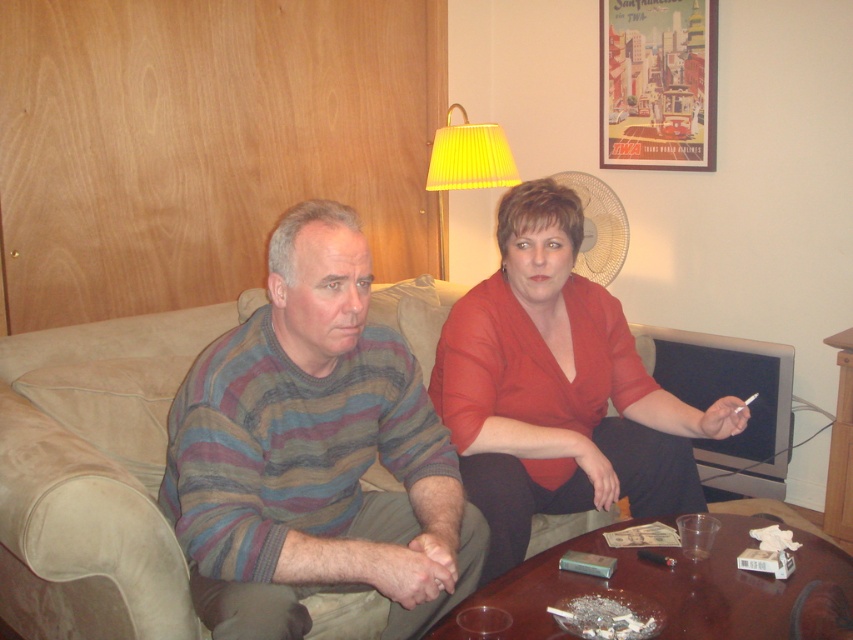
Question: Can you confirm if matte red blouse at center is bigger than yellow pleated shade at upper center?

Choices:
 (A) yes
 (B) no

Answer: (A)

Question: Is suede couch at center positioned before matte red blouse at center?

Choices:
 (A) no
 (B) yes

Answer: (B)

Question: Among these objects, which one is nearest to the camera?

Choices:
 (A) matte red blouse at center
 (B) striped sweater at center
 (C) yellow pleated shade at upper center

Answer: (B)

Question: Which point is farther from the camera taking this photo?

Choices:
 (A) (33, 516)
 (B) (582, 429)
 (C) (496, 140)
 (D) (310, 490)

Answer: (C)

Question: Is matte red blouse at center thinner than yellow pleated shade at upper center?

Choices:
 (A) no
 (B) yes

Answer: (A)

Question: Among these points, which one is farthest from the camera?

Choices:
 (A) (250, 456)
 (B) (134, 620)
 (C) (643, 406)

Answer: (C)